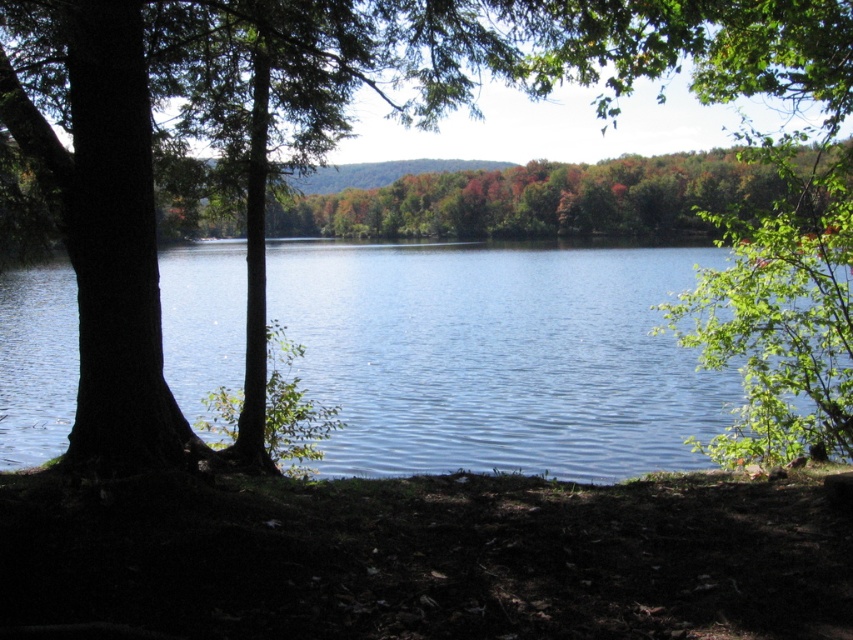
You are standing at the edge of the lake and want to place a small decorative rock exactly at the point marked as point (421,557). What is the terrain like at that location?

The terrain at point (421,557) is dull brown dirt at lower center, which is suitable for placing the decorative rock.

You are standing at the edge of the lake and want to place a small flag exactly at the location of the dull brown dirt at lower center. What are the coordinates where you should place the flag?

The coordinates for the dull brown dirt at lower center are at point (421,557), so place the flag there.